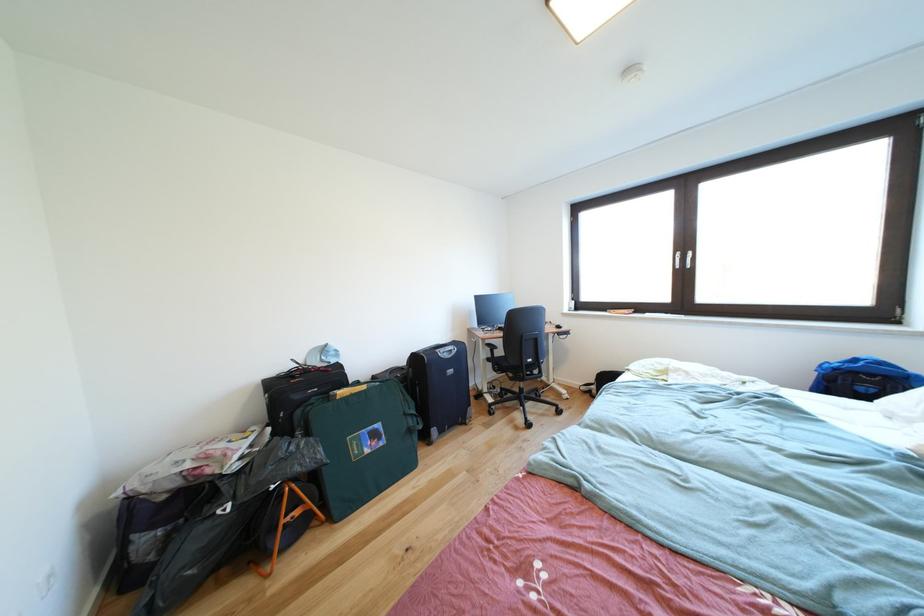
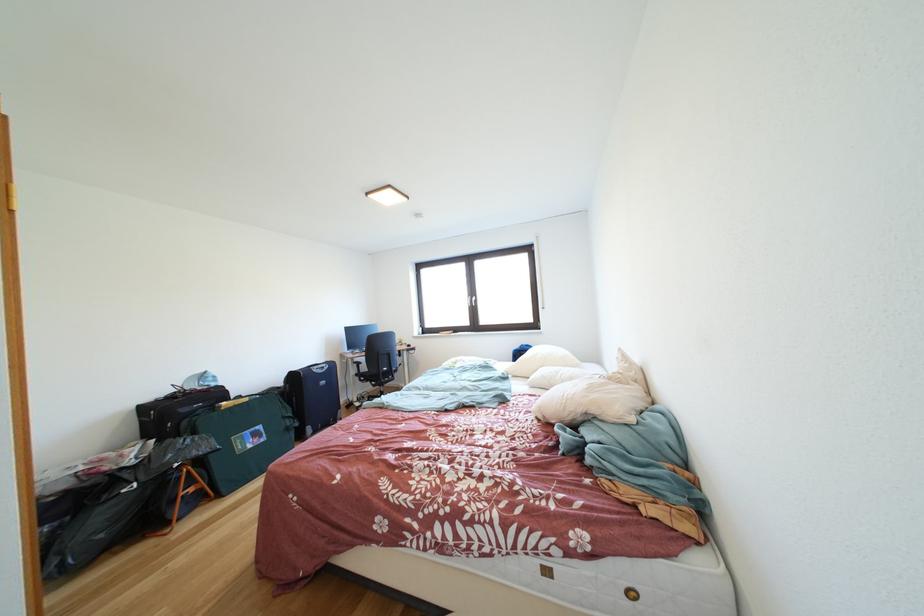
In the second image, find the point that corresponds to point (519, 384) in the first image.

(383, 391)